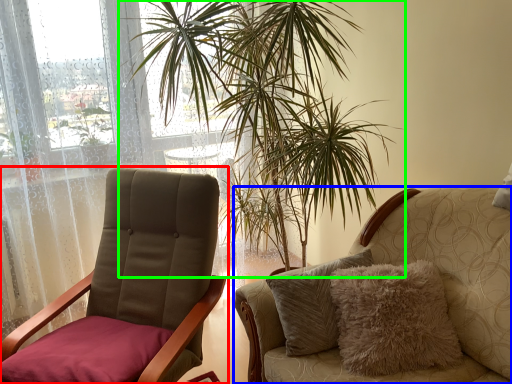
Question: Which is nearer to the chair (highlighted by a red box)? chair (highlighted by a blue box) or houseplant (highlighted by a green box).

Choices:
 (A) chair
 (B) houseplant

Answer: (A)